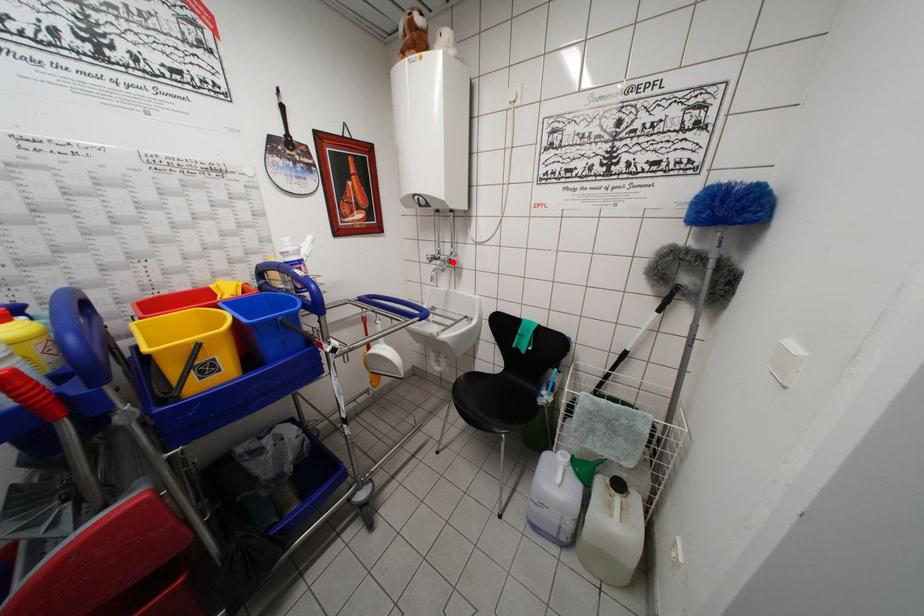
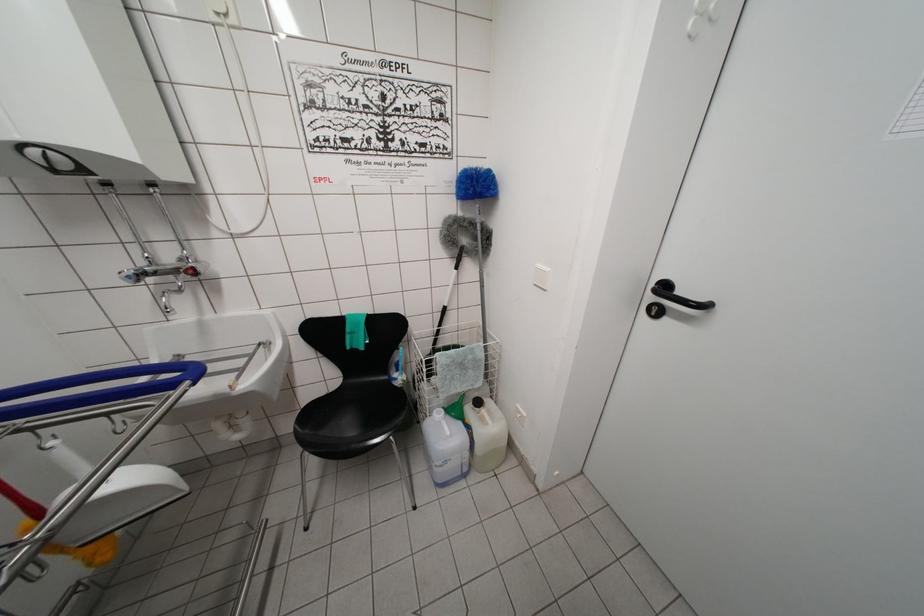
Question: I am providing you with two images of the same scene from different viewpoints. A red point is shown in image1. For the corresponding object point in image2, is it positioned nearer or farther from the camera?

Choices:
 (A) Nearer
 (B) Farther

Answer: (B)